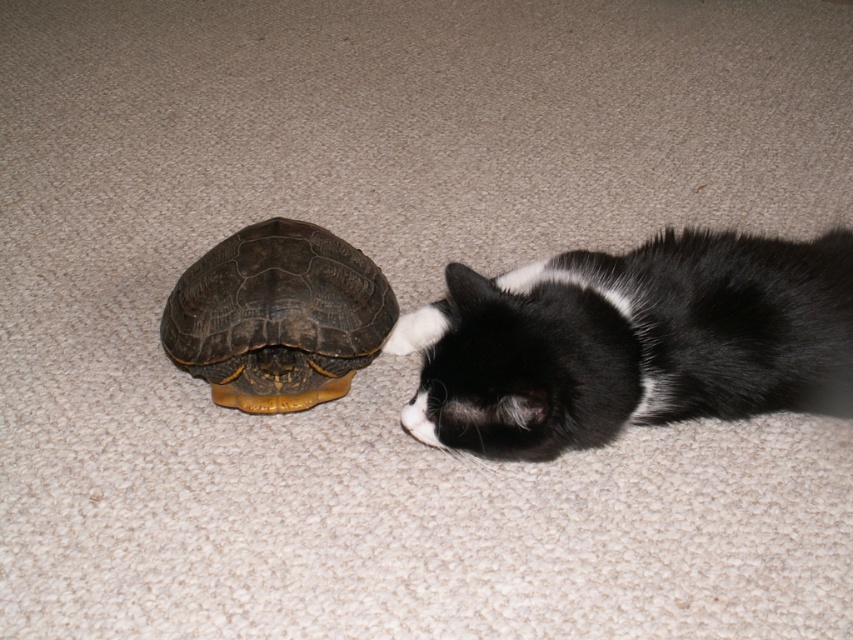
Is point (634, 364) less distant than point (228, 278)?

Yes, point (634, 364) is in front of point (228, 278).

Who is lower down, black fur cat at right or brown textured shell at center?

Positioned lower is brown textured shell at center.

You are a GUI agent. You are given a task and a screenshot of the screen. Output one action in this format:
    pyautogui.click(x=<x>, y=<y>)
    Task: Click on the black fur cat at right
    The width and height of the screenshot is (853, 640).
    Given the screenshot: What is the action you would take?
    pyautogui.click(x=631, y=340)